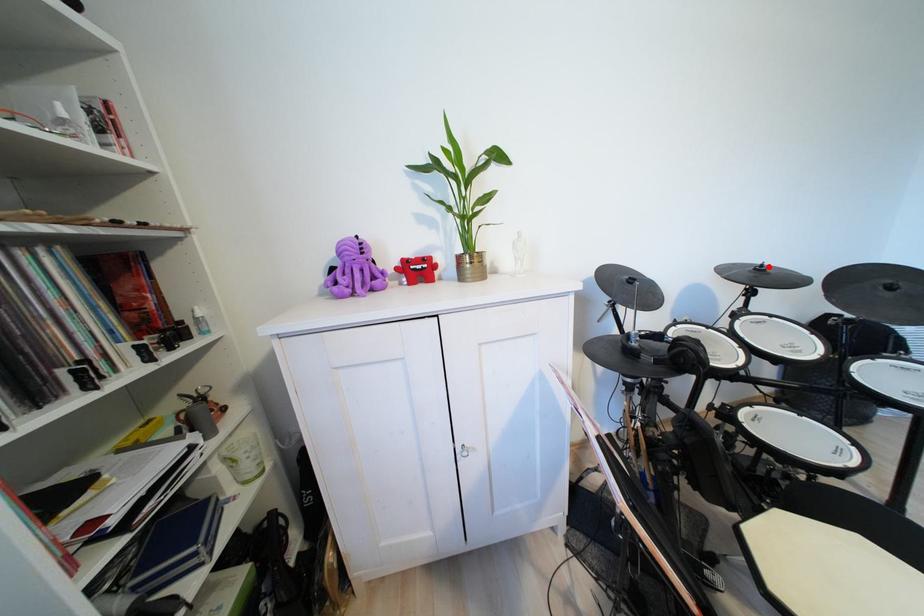
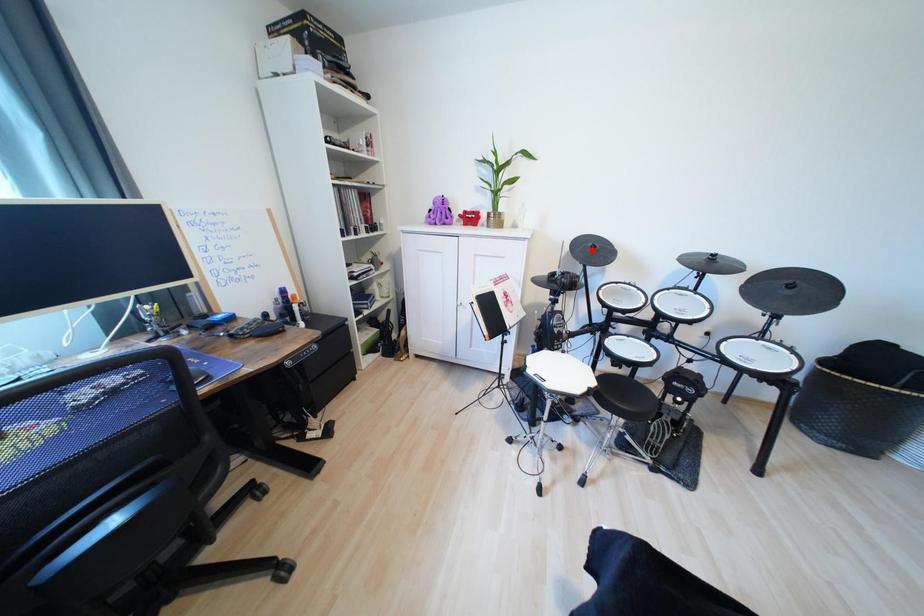
I am providing you with two images of the same scene from different viewpoints. A red point is marked on the first image and another point is marked on the second image. Do the highlighted points in image1 and image2 indicate the same real-world spot?

No